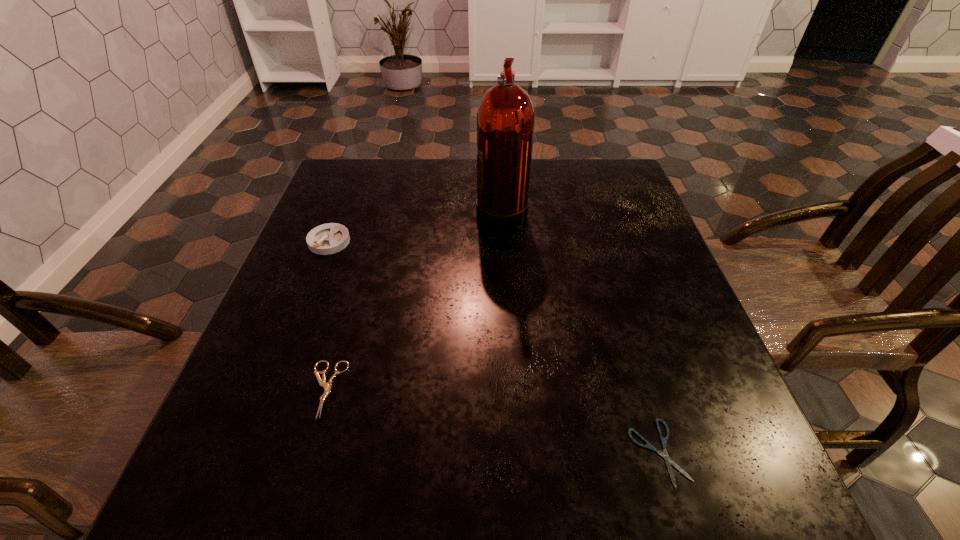
Locate an element on the screen. The image size is (960, 540). vacant space located 0.130m on the front-facing side of the fire extinguisher is located at coordinates (426, 211).

The width and height of the screenshot is (960, 540). Find the location of `free space located on the right of the ashtray`. free space located on the right of the ashtray is located at coordinates (483, 241).

At what (x,y) coordinates should I click in order to perform the action: click on vacant point located on the back of the taller shears. Please return your answer as a coordinate pair (x, y). The width and height of the screenshot is (960, 540). Looking at the image, I should click on (366, 249).

At what (x,y) coordinates should I click in order to perform the action: click on vacant space located 0.360m on the left of the shorter shears. Please return your answer as a coordinate pair (x, y). This screenshot has width=960, height=540. Looking at the image, I should click on (x=401, y=452).

Find the location of `object present at the far edge`. object present at the far edge is located at coordinates (505, 118).

Identify the location of object that is at the near edge. (663, 440).

Find the location of a particular element. ashtray at the left edge is located at coordinates (329, 238).

Locate an element on the screen. The image size is (960, 540). shears situated at the left edge is located at coordinates click(x=327, y=387).

Identify the location of object present at the right edge. The width and height of the screenshot is (960, 540). (663, 440).

What are the coordinates of `object at the near right corner` in the screenshot? It's located at (663, 440).